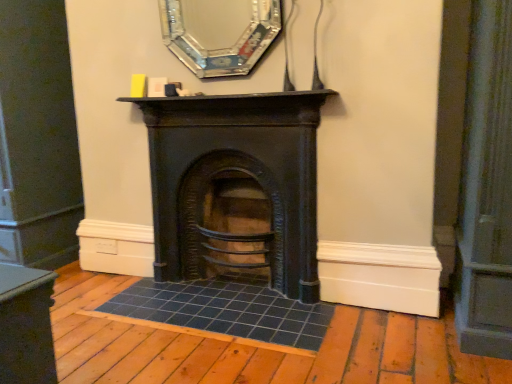
Question: From the image's perspective, is black cast iron fireplace at center located above or below silver metallic mirror at upper center?

Choices:
 (A) below
 (B) above

Answer: (A)

Question: In terms of width, does black cast iron fireplace at center look wider or thinner when compared to silver metallic mirror at upper center?

Choices:
 (A) thin
 (B) wide

Answer: (B)

Question: From a real-world perspective, relative to silver metallic mirror at upper center, is black cast iron fireplace at center vertically above or below?

Choices:
 (A) above
 (B) below

Answer: (B)

Question: Is silver metallic mirror at upper center wider or thinner than black cast iron fireplace at center?

Choices:
 (A) thin
 (B) wide

Answer: (A)

Question: Is silver metallic mirror at upper center in front of or behind black cast iron fireplace at center in the image?

Choices:
 (A) behind
 (B) front

Answer: (B)

Question: From the image's perspective, is silver metallic mirror at upper center above or below black cast iron fireplace at center?

Choices:
 (A) above
 (B) below

Answer: (A)

Question: Based on their positions, is silver metallic mirror at upper center located to the left or right of black cast iron fireplace at center?

Choices:
 (A) right
 (B) left

Answer: (B)